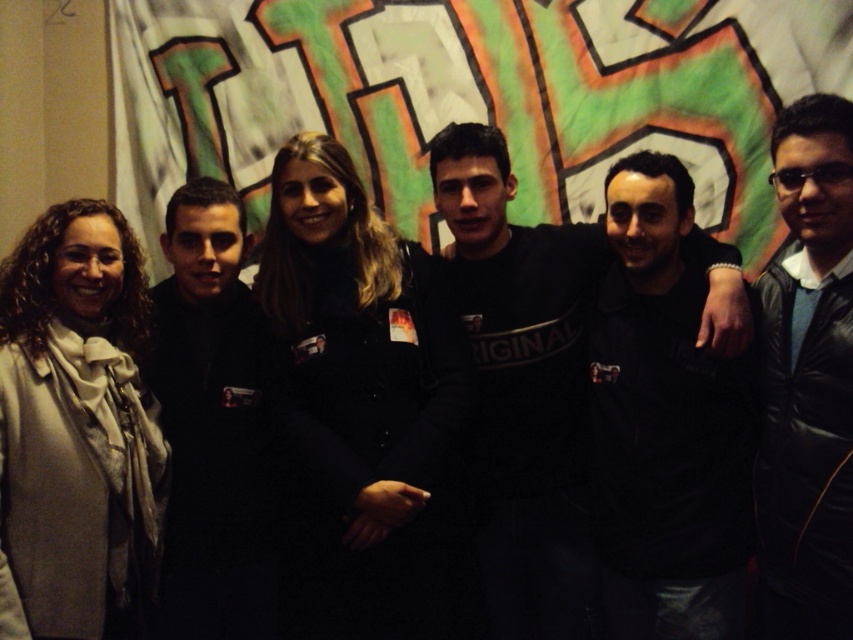
You are a photographer trying to adjust the lighting for the group photo. You notice the white soft scarf at left and the black matte shirt at center. Which object is located more to the left side of the image?

The white soft scarf at left is positioned on the left side of the black matte shirt at center, so it is more to the left.

Looking at this image, you are a photographer trying to adjust the lighting for a group photo. You notice the white soft scarf at left and the black matte shirt at center. Which object requires more light to ensure it is properly illuminated?

The white soft scarf at left requires more light because it has a lesser width compared to the black matte shirt at center, making it potentially less visible in the image.